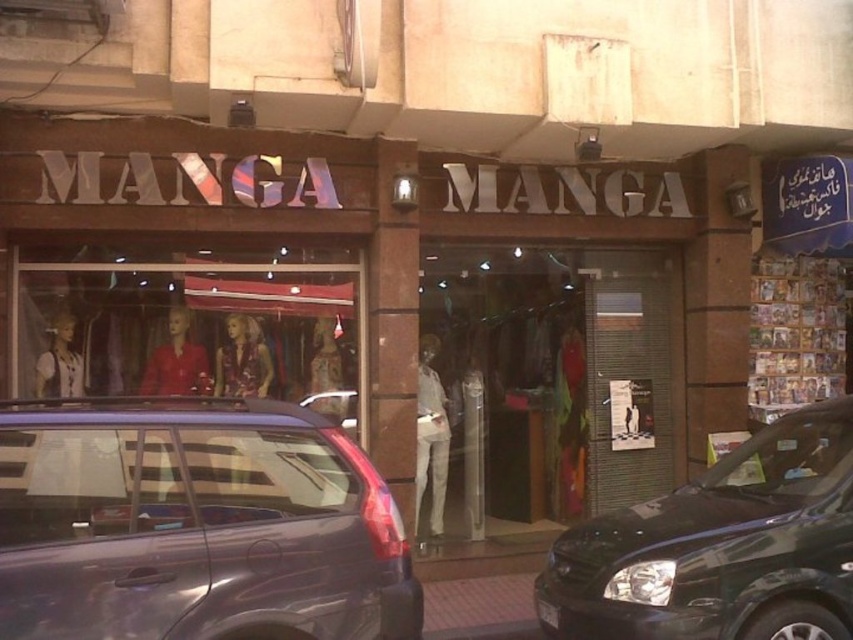
You are a delivery person trying to park your 1.8 meters tall delivery cart in front of the MANGA shop. There is a shiny black car at right and a black plastic license plate at center. Can your cart fit between them vertically?

The shiny black car at right has a greater height compared to black plastic license plate at center. Since the cart is 1.8 meters tall, it may not fit if the car is taller than 1.8 meters. However, the license plate is shorter, so the cart might fit under the car near the license plate area.

You are a delivery person with a box that is 12 feet long. You need to place it between the matte glass mannequins at center and the black plastic license plate at center. Can the box fit in that space?

The distance between the matte glass mannequins at center and the black plastic license plate at center is 11.95 feet. Since the box is 12 feet long, it cannot fit in the space as it is slightly longer than the available distance.

You are standing in front of the MANGA shop and want to take a photo of the shiny black car at right. If your camera has a maximum focus range of 4 meters, will it be able to capture the car clearly?

The distance between the shiny black car at right and the camera is 3.85 meters, which is within the camera maximum focus range of 4 meters. Therefore, the camera can capture the shiny black car at right clearly.